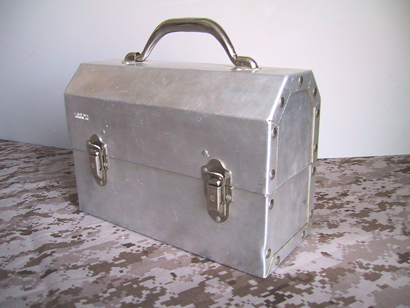
I want to click on handle, so click(x=198, y=25).